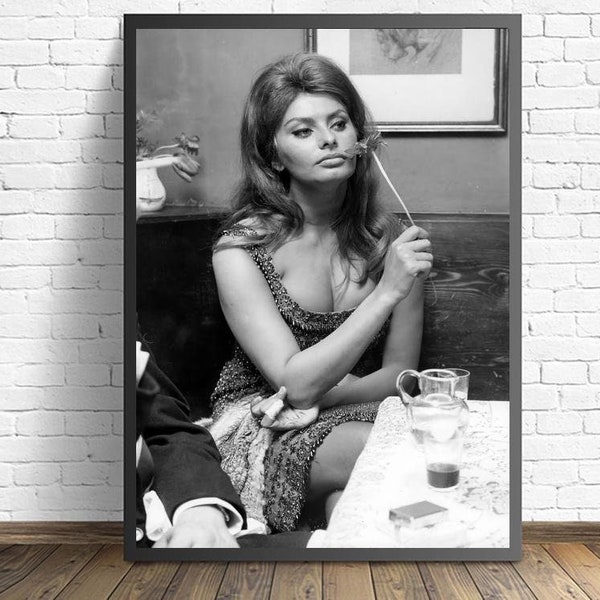
The height and width of the screenshot is (600, 600). I want to click on wood panel flooring, so click(319, 582).